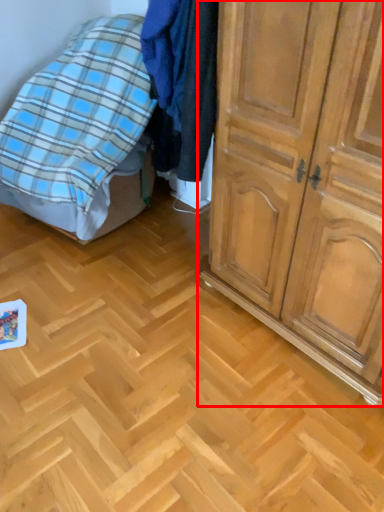
Question: Considering the relative positions of cupboard (annotated by the red box) and bed in the image provided, where is cupboard (annotated by the red box) located with respect to the staircase?

Choices:
 (A) right
 (B) left

Answer: (A)